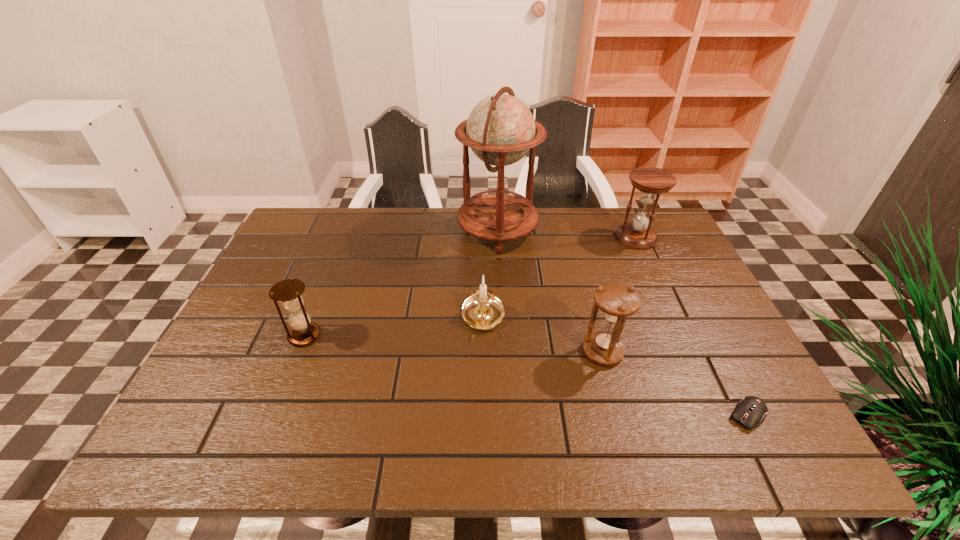
At what (x,y) coordinates should I click in order to perform the action: click on globe. Please return your answer as a coordinate pair (x, y). The image size is (960, 540). Looking at the image, I should click on (500, 130).

Find the location of a particular element. the farthest hourglass is located at coordinates (650, 181).

Where is `the fourth object from left to right`? the fourth object from left to right is located at coordinates (617, 301).

The height and width of the screenshot is (540, 960). Identify the location of the fourth tallest object. (289, 292).

I want to click on the shortest hourglass, so click(289, 292).

Identify the location of the second shortest object. (482, 310).

This screenshot has height=540, width=960. What are the coordinates of `the nearest object` in the screenshot? It's located at (751, 410).

The image size is (960, 540). Identify the location of the shortest object. (751, 410).

The height and width of the screenshot is (540, 960). In order to click on free space located on the surface of the tallest object in this screenshot , I will do `click(442, 231)`.

Where is `free point located on the surface of the tallest object`? The image size is (960, 540). free point located on the surface of the tallest object is located at coordinates (387, 231).